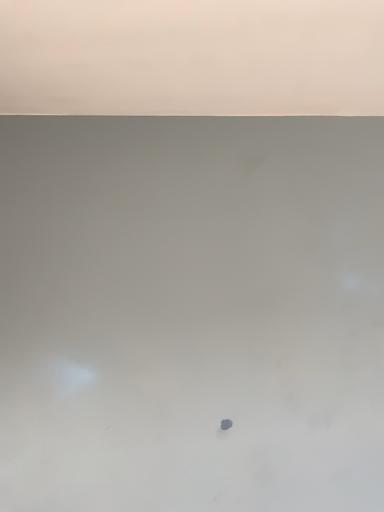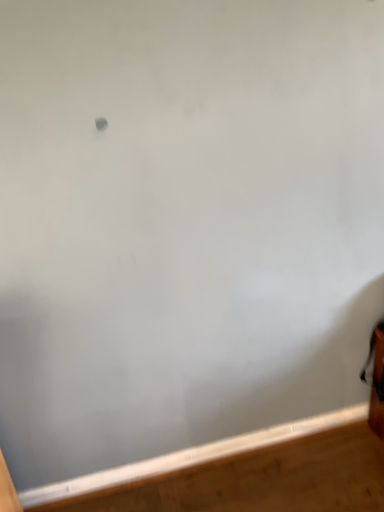
Question: Which way did the camera rotate in the video?

Choices:
 (A) rotated right
 (B) rotated left

Answer: (A)